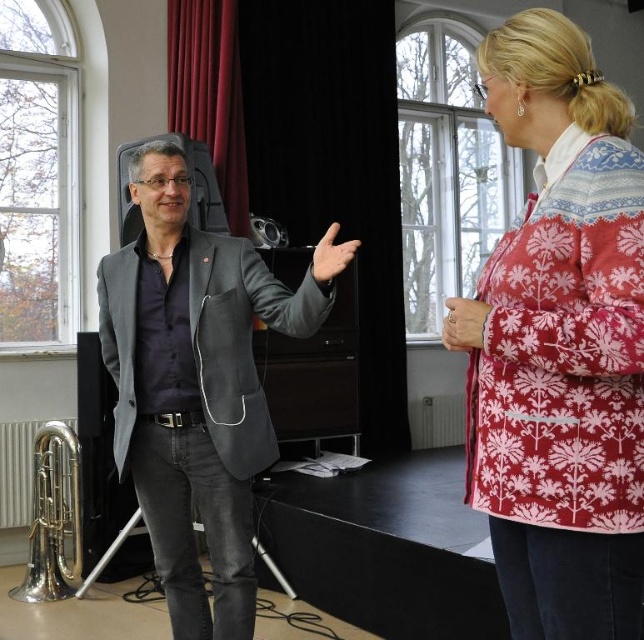
You are a photographer setting up for a portrait session in this room. You need to ensure that both the patterned woolen jacket at upper right and the gray matte blazer at center are visible in the frame. Given their heights, which item might require adjustment to ensure it is fully captured in the photo?

The patterned woolen jacket at upper right has a lesser height compared to gray matte blazer at center, so it might require adjustment to ensure it is fully captured in the photo.

You are an event planner arranging a photo shoot in the room. You need to place a spotlight on the patterned woolen jacket at upper right and the gray matte blazer at center. According to the scene, which jacket is positioned to the right of the other?

The patterned woolen jacket at upper right is positioned on the right side of gray matte blazer at center.

You are standing in the room and want to hand a microphone to the person wearing the patterned woolen jacket at upper right. The microphone is currently on the stand 2.5 feet away from you. Can you reach them without moving?

The patterned woolen jacket at upper right is 3.90 feet away from the viewer. The microphone is 2.5 feet away from you, so the distance between you and the jacket is greater than the microphone distance. Therefore, you cannot reach the person without moving.